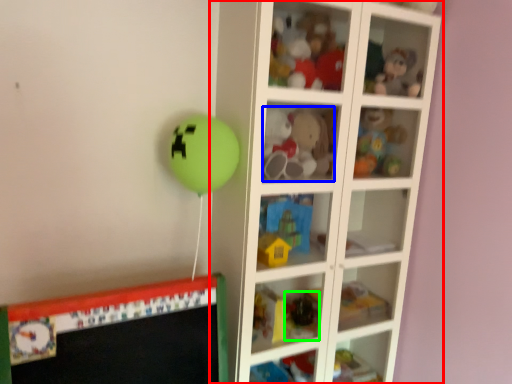
Question: Which object is the farthest from shelf (highlighted by a red box)? Choose among these: toy (highlighted by a blue box) or toy (highlighted by a green box).

Choices:
 (A) toy
 (B) toy

Answer: (B)